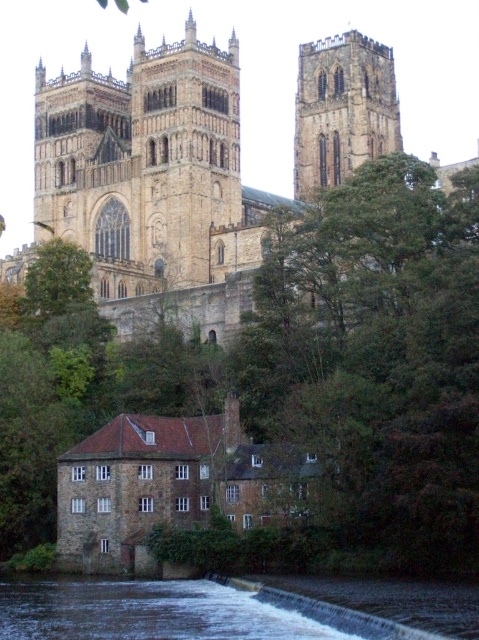
Question: Considering the relative positions of dark gray concrete river at lower center and brown stone tower at upper center in the image provided, where is dark gray concrete river at lower center located with respect to brown stone tower at upper center?

Choices:
 (A) left
 (B) right

Answer: (A)

Question: Which of these objects is positioned closest to the green leafy tree at center?

Choices:
 (A) brown stone church at upper center
 (B) brown stone tower at upper center

Answer: (A)

Question: From the image, what is the correct spatial relationship of brown stone church at upper center in relation to dark gray concrete river at lower center?

Choices:
 (A) left
 (B) right

Answer: (A)

Question: Based on their relative distances, which object is farther from the brown stone tower at upper center?

Choices:
 (A) green leafy tree at center
 (B) brown stone church at upper center

Answer: (A)

Question: Which object is closer to the camera taking this photo?

Choices:
 (A) dark gray concrete river at lower center
 (B) green leafy tree at center

Answer: (A)

Question: Does green leafy tree at center appear on the left side of brown stone church at upper center?

Choices:
 (A) yes
 (B) no

Answer: (B)